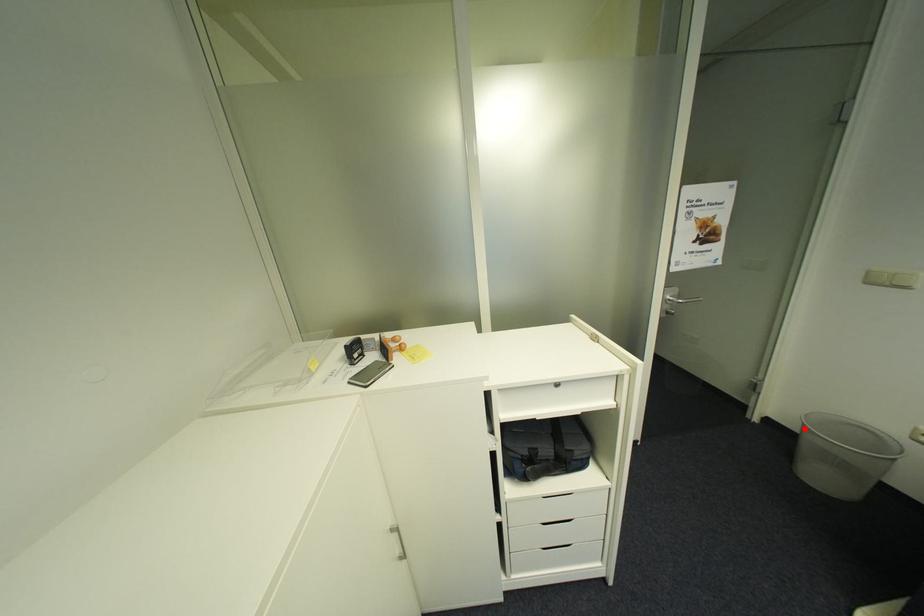
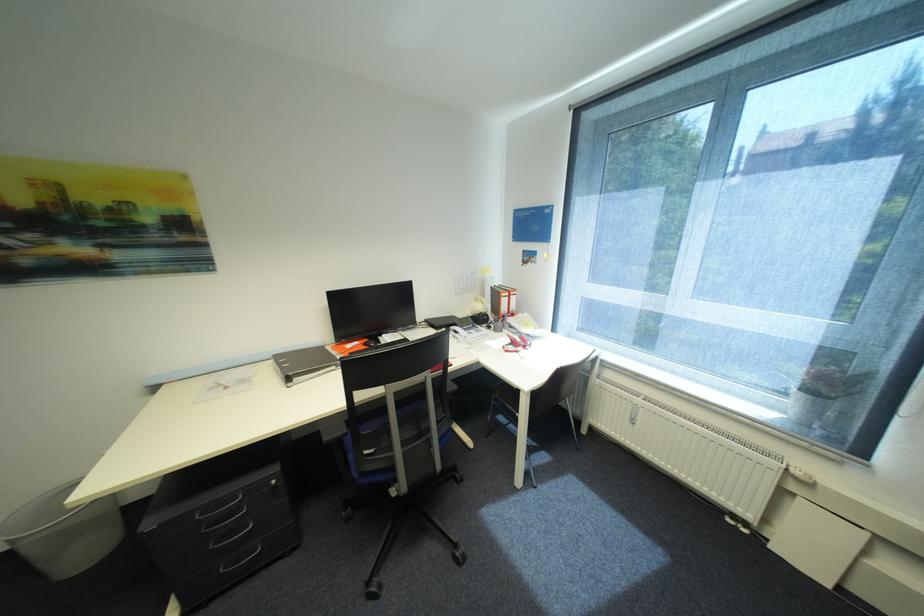
Locate, in the second image, the point that corresponds to the highlighted location in the first image.

(14, 548)